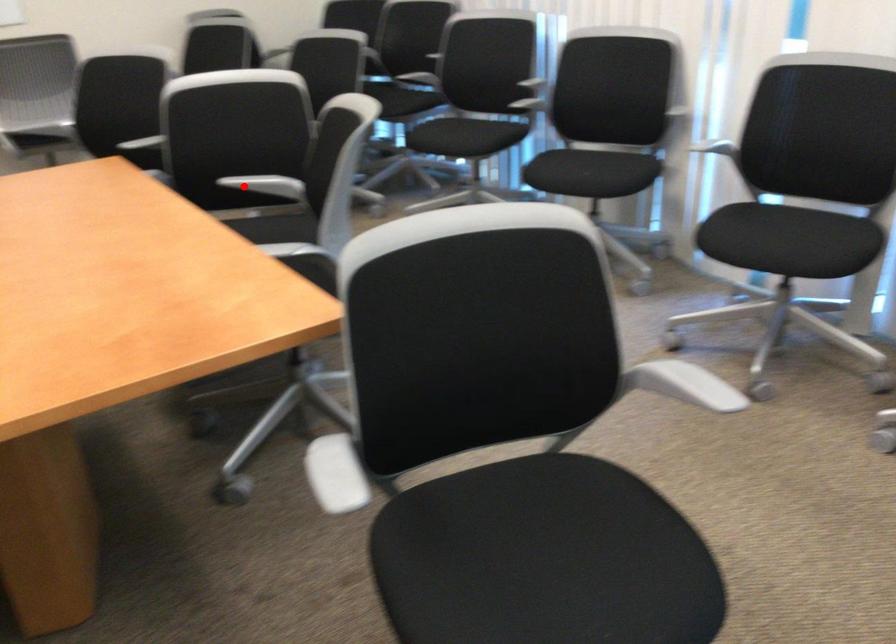
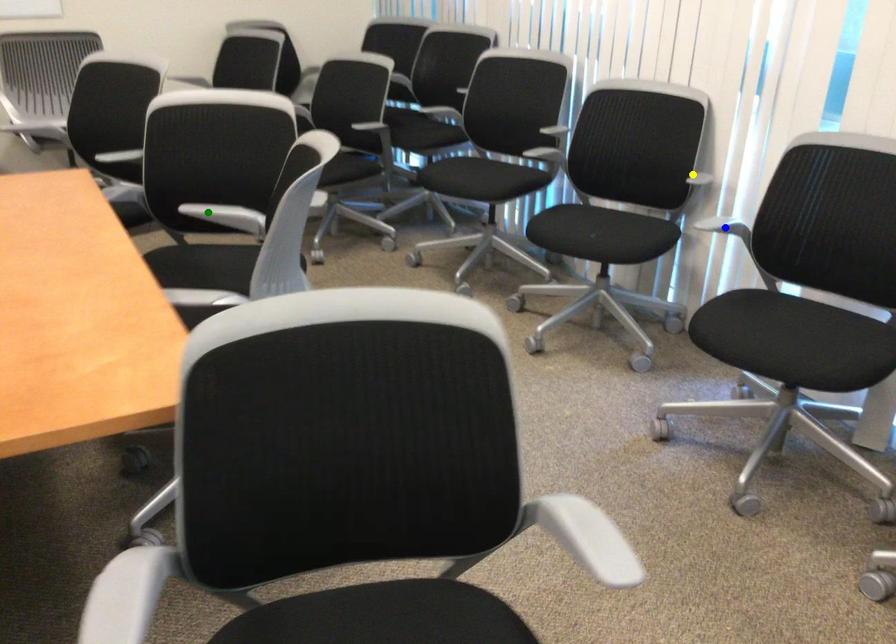
Question: I am providing you with two images of the same scene from different viewpoints. A red point is marked on the first image. You are given multiple points on the second image. Which point in image 2 is actually the same real-world point as the red point in image 1?

Choices:
 (A) yellow point
 (B) blue point
 (C) green point

Answer: (C)